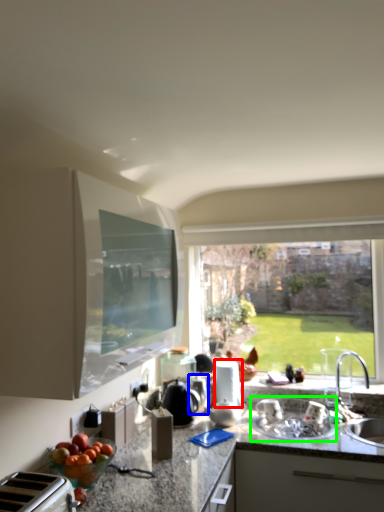
Question: Which object is positioned farthest from appliance (highlighted by a red box)? Select from appliance (highlighted by a blue box) and sink (highlighted by a green box).

Choices:
 (A) appliance
 (B) sink

Answer: (B)